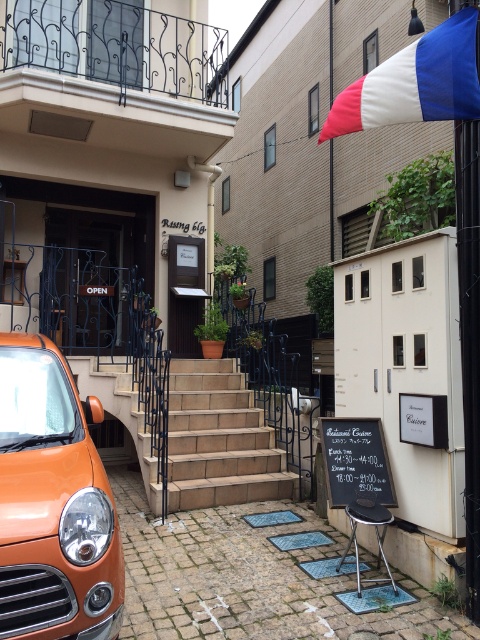
Does orange matte car at left have a greater height compared to metallic gate at center?

In fact, orange matte car at left may be shorter than metallic gate at center.

Is orange matte car at left smaller than metallic gate at center?

Correct, orange matte car at left occupies less space than metallic gate at center.

In order to click on orange matte car at left in this screenshot , I will do `click(52, 504)`.

Does french flag at upper right appear over black chalkboard at center?

Yes, french flag at upper right is above black chalkboard at center.

Between french flag at upper right and black chalkboard at center, which one has less height?

black chalkboard at center is shorter.

What do you see at coordinates (309, 140) in the screenshot? The width and height of the screenshot is (480, 640). I see `french flag at upper right` at bounding box center [309, 140].

The width and height of the screenshot is (480, 640). Identify the location of french flag at upper right. (309, 140).

Who is higher up, metallic gate at center or tricolor fabric flag at upper right?

Positioned higher is tricolor fabric flag at upper right.

Can you confirm if metallic gate at center is shorter than tricolor fabric flag at upper right?

In fact, metallic gate at center may be taller than tricolor fabric flag at upper right.

This screenshot has height=640, width=480. Find the location of `metallic gate at center`. metallic gate at center is located at coordinates (85, 282).

Find the location of `metallic gate at center`. metallic gate at center is located at coordinates (85, 282).